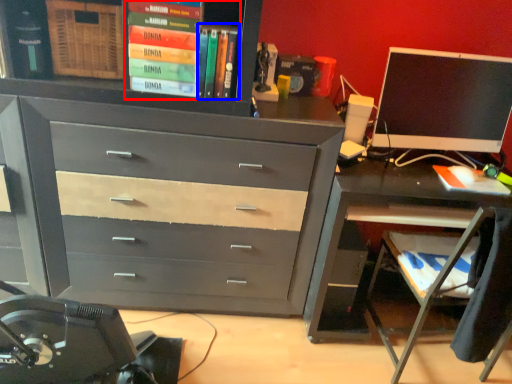
Question: Which object appears closest to the camera in this image, book (highlighted by a red box) or book (highlighted by a blue box)?

Choices:
 (A) book
 (B) book

Answer: (A)